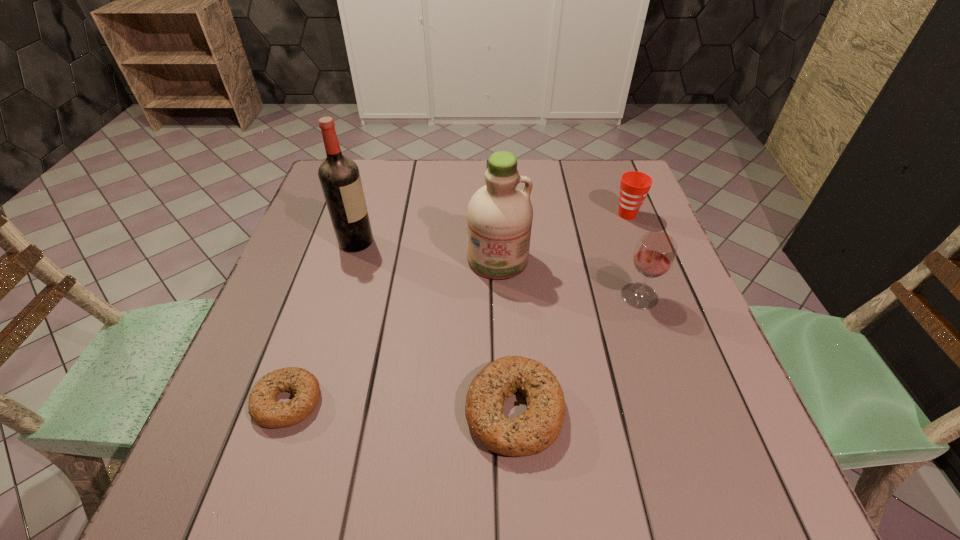
The image size is (960, 540). What are the coordinates of `wineglass at the right edge` in the screenshot? It's located at (654, 255).

The image size is (960, 540). What are the coordinates of `object that is at the near left corner` in the screenshot? It's located at (264, 409).

This screenshot has height=540, width=960. I want to click on object at the far right corner, so [x=634, y=186].

Find the location of a particular element. The image size is (960, 540). vacant area at the far edge is located at coordinates (564, 204).

The image size is (960, 540). Find the location of `vacant space at the near edge of the desktop`. vacant space at the near edge of the desktop is located at coordinates (625, 409).

In the image, there is a desktop. Identify the location of vacant space at the left edge. (269, 311).

You are a GUI agent. You are given a task and a screenshot of the screen. Output one action in this format:
    pyautogui.click(x=<x>, y=<y>)
    Task: Click on the vacant space at the right edge of the desktop
    The image size is (960, 540).
    Given the screenshot: What is the action you would take?
    pyautogui.click(x=670, y=352)

Identify the location of free space at the far left corner of the desktop. (361, 172).

This screenshot has width=960, height=540. Identify the location of vacant position at the far right corner of the desktop. (647, 202).

The height and width of the screenshot is (540, 960). Identify the location of free space at the near right corner of the desktop. (659, 400).